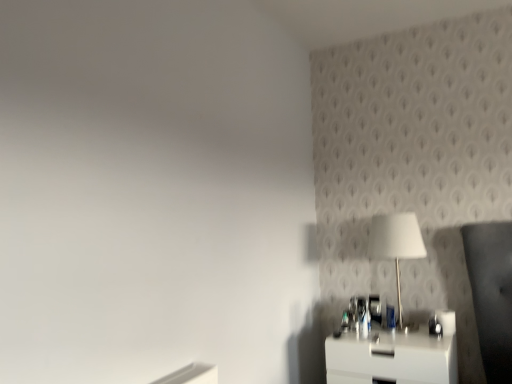
Question: From the image's perspective, is white glossy table lamp at upper right below white glossy nightstand at lower right?

Choices:
 (A) no
 (B) yes

Answer: (A)

Question: Is white glossy nightstand at lower right surrounded by white glossy table lamp at upper right?

Choices:
 (A) yes
 (B) no

Answer: (B)

Question: Is white glossy table lamp at upper right wider than white glossy nightstand at lower right?

Choices:
 (A) yes
 (B) no

Answer: (B)

Question: Can you see white glossy table lamp at upper right touching white glossy nightstand at lower right?

Choices:
 (A) no
 (B) yes

Answer: (A)

Question: Does white glossy table lamp at upper right appear on the right side of white glossy nightstand at lower right?

Choices:
 (A) yes
 (B) no

Answer: (A)

Question: Is white glossy table lamp at upper right facing towards white glossy nightstand at lower right?

Choices:
 (A) no
 (B) yes

Answer: (A)

Question: Considering the relative sizes of white glossy nightstand at lower right and white glossy table lamp at upper right in the image provided, is white glossy nightstand at lower right bigger than white glossy table lamp at upper right?

Choices:
 (A) no
 (B) yes

Answer: (B)

Question: From a real-world perspective, is white glossy nightstand at lower right on top of white glossy table lamp at upper right?

Choices:
 (A) no
 (B) yes

Answer: (A)

Question: Is white glossy nightstand at lower right at the left side of white glossy table lamp at upper right?

Choices:
 (A) no
 (B) yes

Answer: (B)

Question: Is white glossy nightstand at lower right located outside white glossy table lamp at upper right?

Choices:
 (A) yes
 (B) no

Answer: (A)

Question: Would you say white glossy table lamp at upper right is part of white glossy nightstand at lower right's contents?

Choices:
 (A) yes
 (B) no

Answer: (B)

Question: Is white glossy nightstand at lower right further to the viewer compared to white glossy table lamp at upper right?

Choices:
 (A) no
 (B) yes

Answer: (A)

Question: Is point (403, 235) positioned closer to the camera than point (414, 369)?

Choices:
 (A) closer
 (B) farther

Answer: (B)